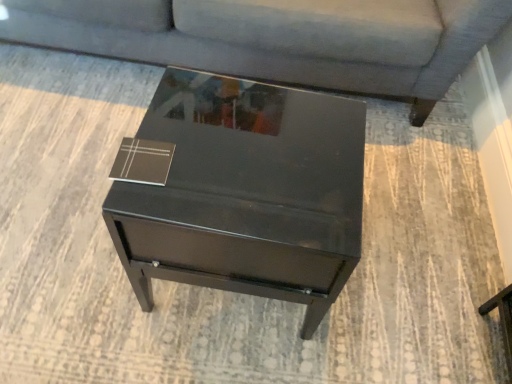
This screenshot has width=512, height=384. Find the location of `blank space situated above glossy black table at center (from a real-world perspective)`. blank space situated above glossy black table at center (from a real-world perspective) is located at coordinates (243, 144).